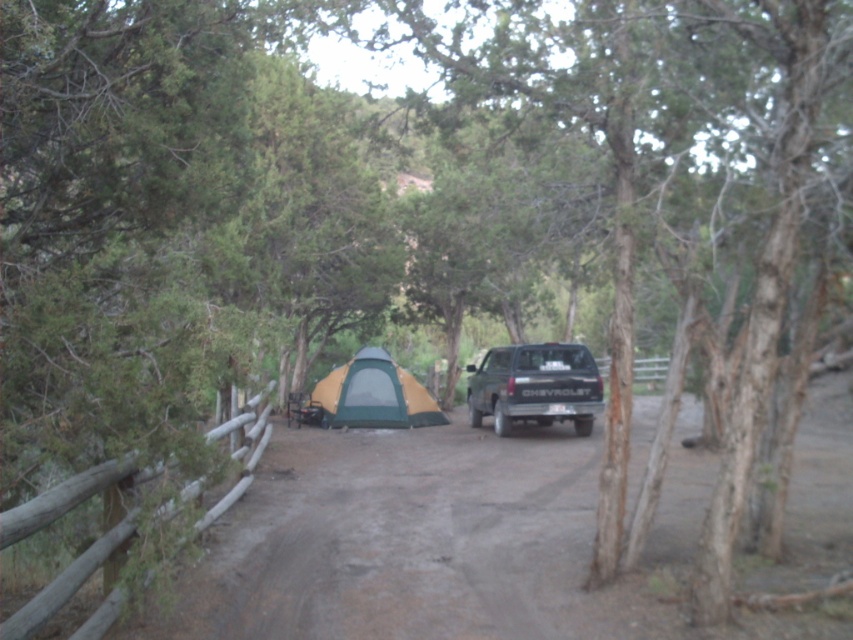
Is dirt track at center taller than green fabric tent at center?

No.

Between point (816, 556) and point (369, 419), which one is positioned in front?

Point (816, 556) is more forward.

This screenshot has height=640, width=853. Find the location of `dirt track at center`. dirt track at center is located at coordinates (442, 545).

Is point (575, 518) behind point (491, 364)?

No, (575, 518) is closer to viewer.

I want to click on dirt track at center, so click(442, 545).

This screenshot has width=853, height=640. Describe the element at coordinates (442, 545) in the screenshot. I see `dirt track at center` at that location.

The width and height of the screenshot is (853, 640). I want to click on dirt track at center, so click(442, 545).

Which of these two, matte black truck at center or green fabric tent at center, stands shorter?

green fabric tent at center is shorter.

Does matte black truck at center appear over green fabric tent at center?

Correct, matte black truck at center is located above green fabric tent at center.

Does point (532, 381) lie behind point (370, 424)?

That is False.

Where is `matte black truck at center`? This screenshot has height=640, width=853. matte black truck at center is located at coordinates (535, 387).